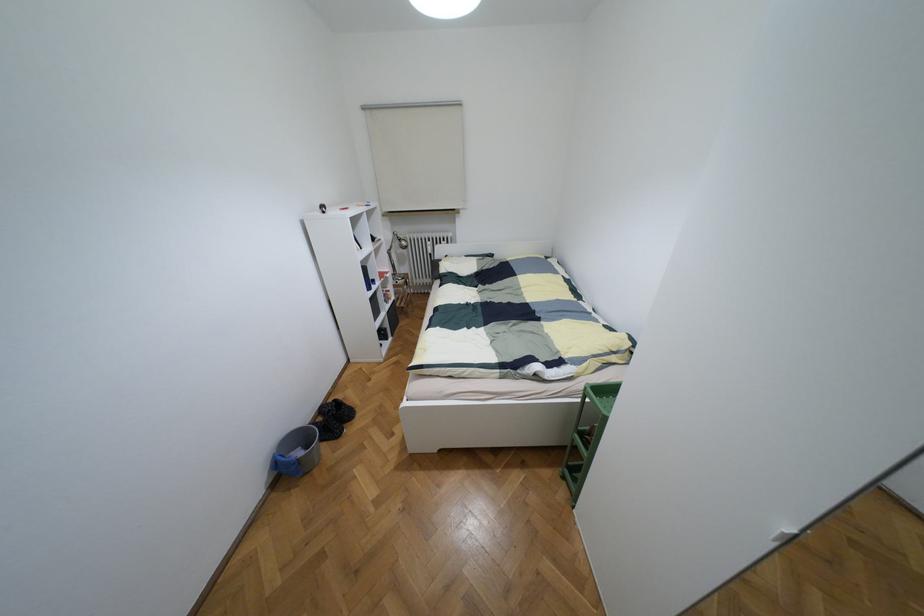
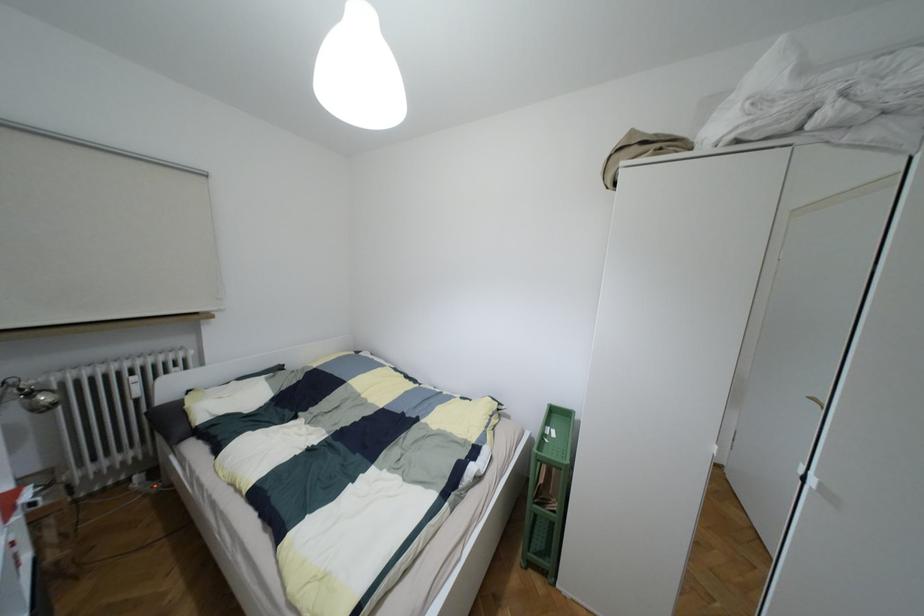
The point at (403,243) is marked in the first image. Where is the corresponding point in the second image?

(43, 397)